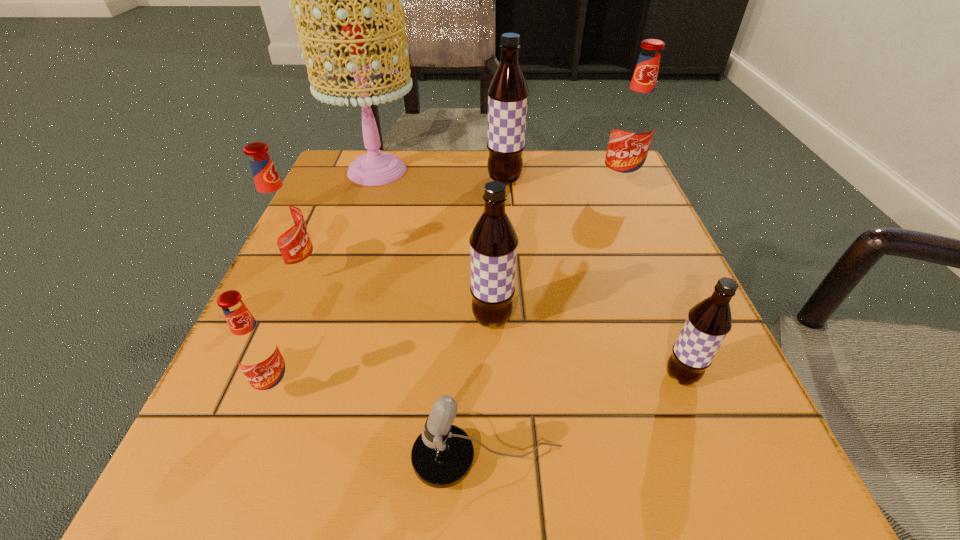
Image resolution: width=960 pixels, height=540 pixels. In order to click on vacant space that satisfies the following two spatial constraints: 1. on the back side of the rightmost brown root beer; 2. on the left side of the farthest red root beer in this screenshot , I will do `click(607, 188)`.

Image resolution: width=960 pixels, height=540 pixels. I want to click on vacant region that satisfies the following two spatial constraints: 1. on the front side of the nearest red root beer; 2. on the right side of the white microphone, so click(249, 464).

This screenshot has width=960, height=540. What are the coordinates of `blank area in the image that satisfies the following two spatial constraints: 1. on the back side of the nearest red root beer; 2. on the right side of the lampshade` in the screenshot? It's located at (362, 171).

Locate an element on the screen. This screenshot has width=960, height=540. free space that satisfies the following two spatial constraints: 1. on the back side of the fifth nearest object; 2. on the right side of the farthest red root beer is located at coordinates (338, 188).

Find the location of a particular element. vacant position in the image that satisfies the following two spatial constraints: 1. on the back side of the nearest brown root beer; 2. on the right side of the microphone is located at coordinates (487, 376).